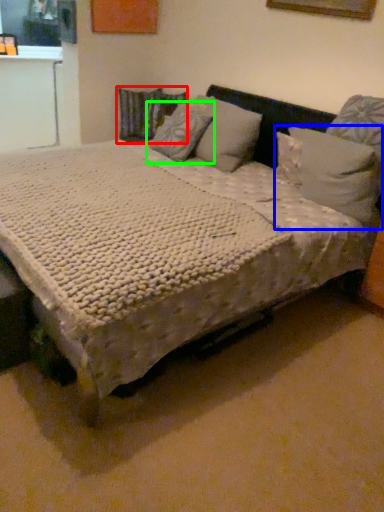
Question: Which object is the closest to the pillow (highlighted by a red box)? Choose among these: pillow (highlighted by a blue box) or pillow (highlighted by a green box).

Choices:
 (A) pillow
 (B) pillow

Answer: (B)